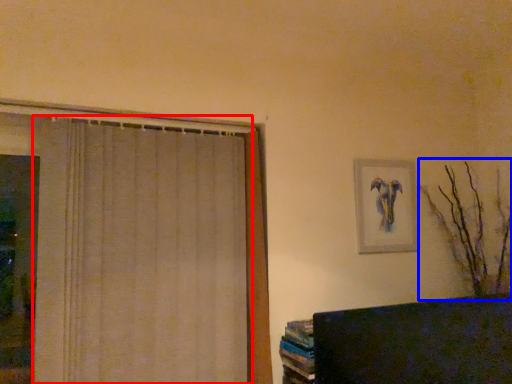
Question: Which object is further to the camera taking this photo, curtain (highlighted by a red box) or branch (highlighted by a blue box)?

Choices:
 (A) curtain
 (B) branch

Answer: (B)